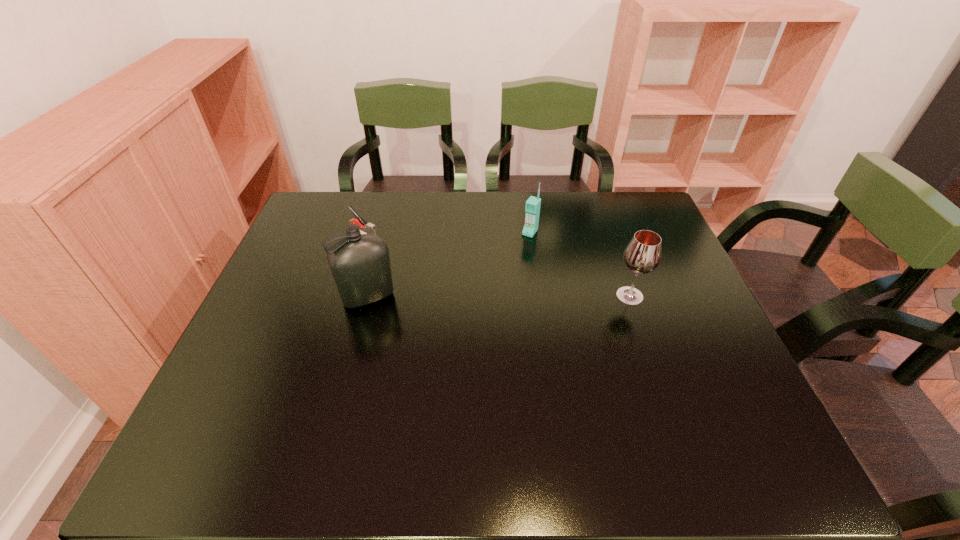
Identify the location of vacant region located 0.160m on the handle side of the shortest object. (418, 259).

Where is `free space located on the handle side of the shortest object`? The height and width of the screenshot is (540, 960). free space located on the handle side of the shortest object is located at coordinates (389, 245).

The image size is (960, 540). I want to click on cellular telephone that is at the far edge, so click(x=532, y=207).

The width and height of the screenshot is (960, 540). In order to click on stapler at the far edge in this screenshot , I will do `click(370, 228)`.

Locate an element on the screen. object that is at the right edge is located at coordinates (642, 255).

You are a GUI agent. You are given a task and a screenshot of the screen. Output one action in this format:
    pyautogui.click(x=<x>, y=<y>)
    Task: Click on the vacant space at the far edge of the desktop
    The height and width of the screenshot is (540, 960).
    Given the screenshot: What is the action you would take?
    pyautogui.click(x=583, y=193)

At what (x,y) coordinates should I click in order to perform the action: click on free location at the near edge. Please return your answer as a coordinate pair (x, y). Looking at the image, I should click on (457, 396).

This screenshot has width=960, height=540. I want to click on vacant point at the left edge, so click(280, 294).

Where is `blank space at the right edge of the desktop`? The height and width of the screenshot is (540, 960). blank space at the right edge of the desktop is located at coordinates (665, 323).

Identify the location of vacant space at the far right corner of the desktop. The image size is (960, 540). (635, 224).